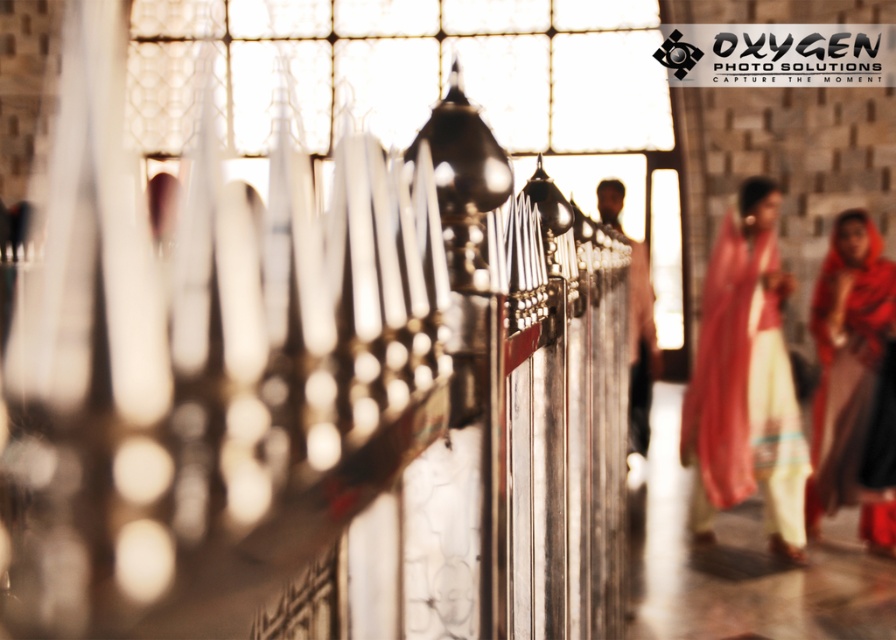
You are a photographer standing in front of the temple railing. You want to take a photo that includes both the matte pink fabric at right and the matte brown shirt at center. Which object should you focus on first to ensure both are in sharp focus?

The matte pink fabric at right is closer to the viewer than the matte brown shirt at center. To ensure both are in sharp focus, you should focus on the matte pink fabric at right first, as it is closer, and the matte brown shirt at center will fall within the depth of field.

You are an interior designer planning to place a decorative item between the matte pink fabric at right and the matte red fabric at right. Which fabric should the item be closer to to ensure it fits within the available space?

The matte pink fabric at right is wider than the matte red fabric at right. Therefore, the decorative item should be placed closer to the matte red fabric at right to accommodate the space difference.

Looking at this image, you are a photographer standing at the entrance of the temple. You want to take a photo that includes both the matte red fabric at right and the matte brown shirt at center. What is the minimum distance you need to move backward to ensure both objects are in frame?

The minimum distance you need to move backward is 2 meters to ensure both the matte red fabric at right and the matte brown shirt at center, which are 1.95 meters apart, are fully captured in the photo.